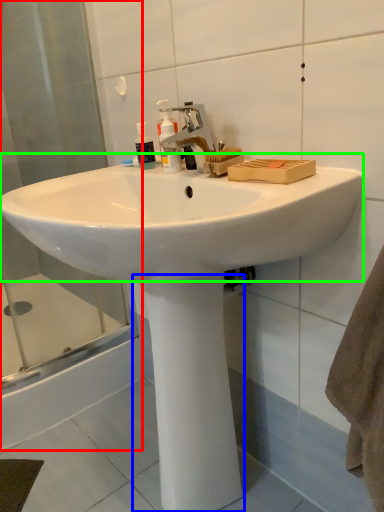
Question: Estimate the real-world distances between objects in this image. Which object is farther from shower door (highlighted by a red box), pillar (highlighted by a blue box) or sink (highlighted by a green box)?

Choices:
 (A) pillar
 (B) sink

Answer: (A)